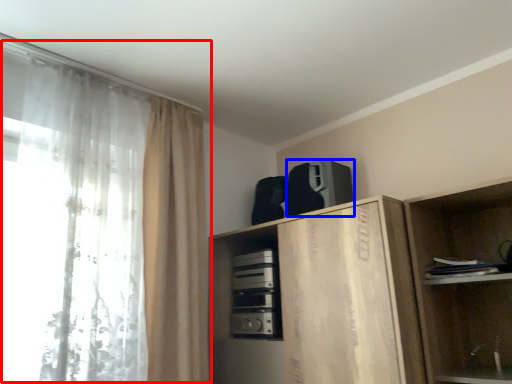
Question: Among these objects, which one is farthest to the camera, curtain (highlighted by a red box) or appliance (highlighted by a blue box)?

Choices:
 (A) curtain
 (B) appliance

Answer: (B)